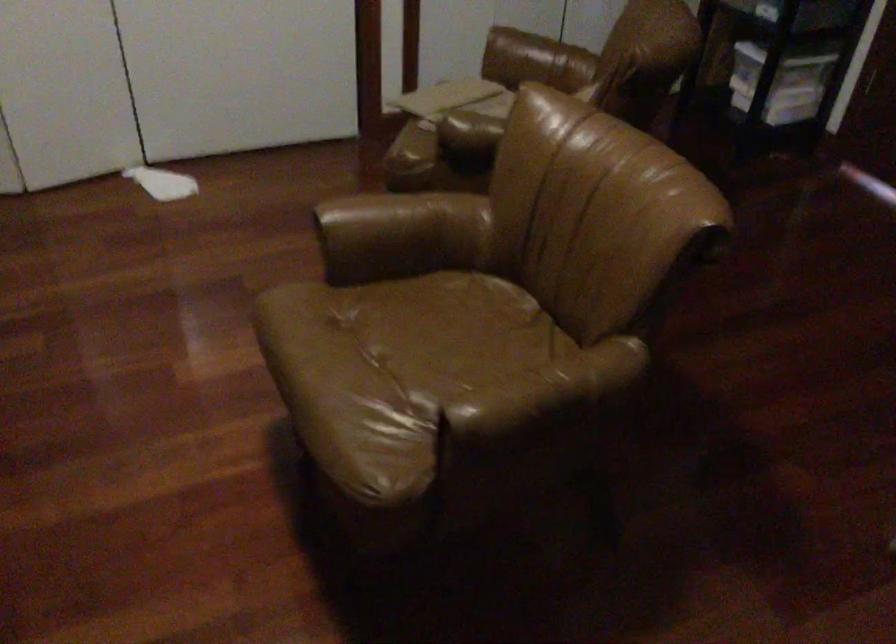
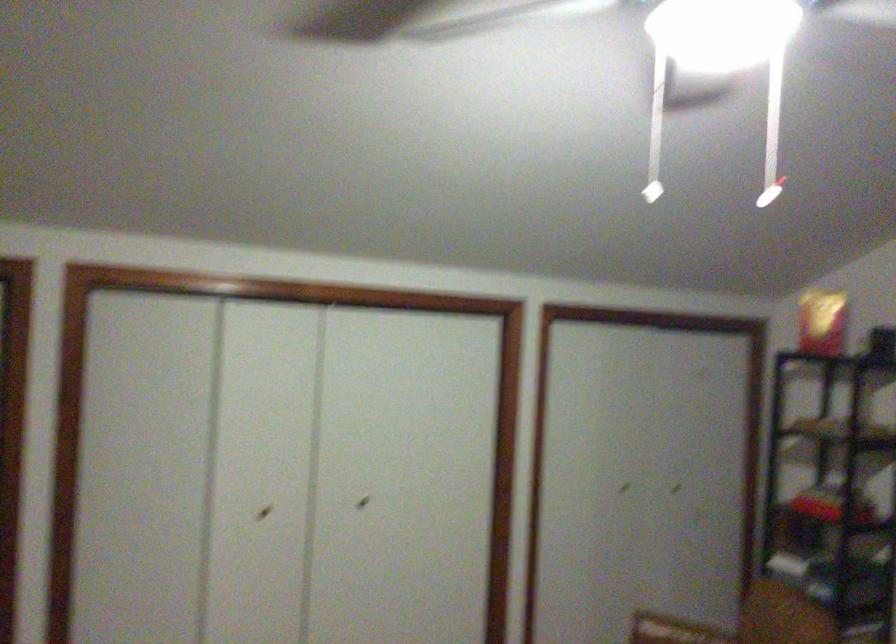
Question: How did the camera likely rotate?

Choices:
 (A) Left
 (B) Right
 (C) Up
 (D) Down

Answer: (C)